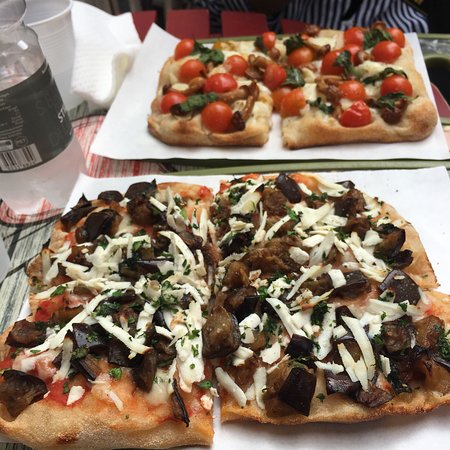
Where is `napkin`? The height and width of the screenshot is (450, 450). napkin is located at coordinates (85, 85).